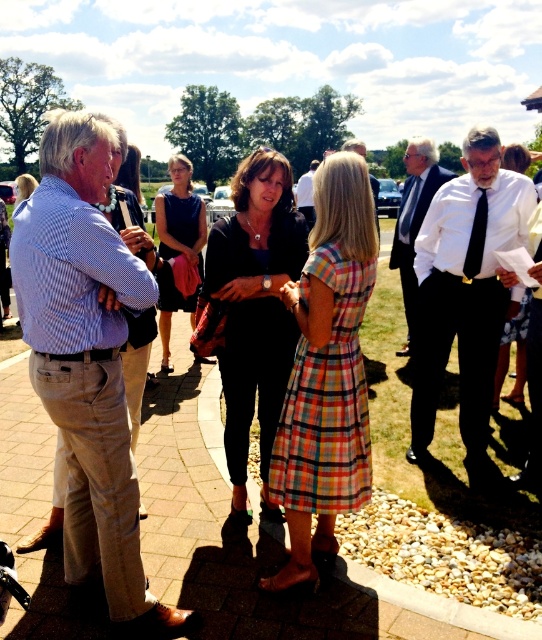
Question: Which point is farther to the camera?

Choices:
 (A) plaid cotton dress at center
 (B) white shirt at center
 (C) plaid fabric dress at center
 (D) light brown leather shoes at center

Answer: (C)

Question: Which object is the closest to the black silk tie at right?

Choices:
 (A) dark blue tie at center
 (B) plaid cotton dress at center

Answer: (A)

Question: Where is matte black dress at center located in relation to plaid fabric dress at center in the image?

Choices:
 (A) right
 (B) left

Answer: (B)

Question: Is dark blue sleeveless dress at center closer to camera compared to light brown leather shoes at center?

Choices:
 (A) no
 (B) yes

Answer: (B)

Question: Which is nearer to the black silk tie at right?

Choices:
 (A) matte black dress at center
 (B) plaid fabric dress at center
 (C) light blue checkered shirt at left

Answer: (B)

Question: Is black silk tie at right closer to camera compared to light brown leather shoes at center?

Choices:
 (A) yes
 (B) no

Answer: (A)